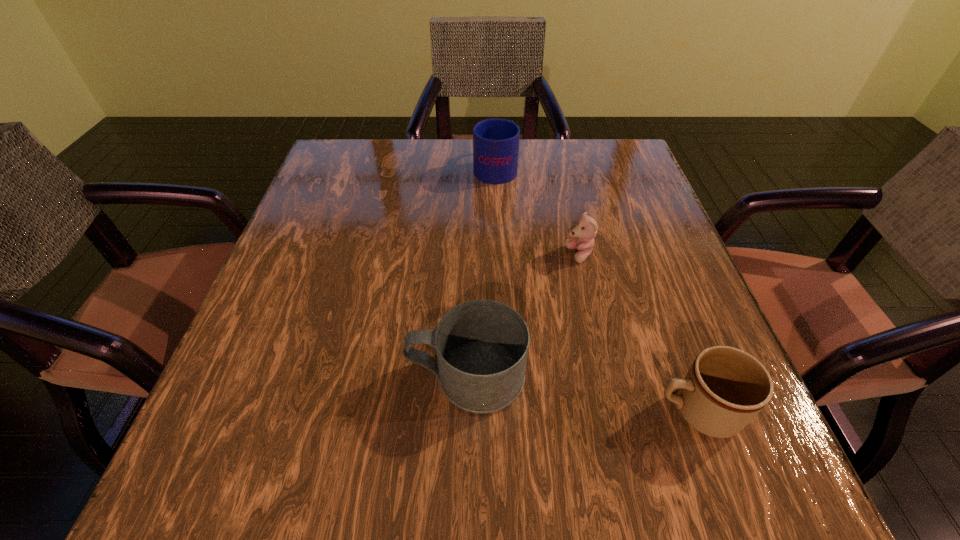
In the image, there is a desktop. Identify the location of free space at the far right corner. (625, 151).

This screenshot has width=960, height=540. In order to click on vacant space that is in between the farthest mug and the second object from right to left in this screenshot , I will do (x=538, y=211).

Locate an element on the screen. vacant area that lies between the farthest object and the teddy bear is located at coordinates (538, 211).

You are a GUI agent. You are given a task and a screenshot of the screen. Output one action in this format:
    pyautogui.click(x=<x>, y=<y>)
    Task: Click on the vacant area between the third nearest object and the farthest mug
    Image resolution: width=960 pixels, height=540 pixels.
    Given the screenshot: What is the action you would take?
    pyautogui.click(x=538, y=211)

The width and height of the screenshot is (960, 540). I want to click on free space between the second farthest object and the farthest object, so click(x=538, y=211).

Image resolution: width=960 pixels, height=540 pixels. In order to click on object that is the closest to the farthest object in this screenshot , I will do `click(586, 228)`.

In order to click on object that is the third closest to the third object from left to right in this screenshot , I will do `click(725, 388)`.

Identify which mug is the second nearest to the rightmost object. Please provide its 2D coordinates. Your answer should be formatted as a tuple, i.e. [(x, y)], where the tuple contains the x and y coordinates of a point satisfying the conditions above.

[(495, 141)]

Identify the location of mug object that ranks as the closest to the farthest mug. (482, 346).

Identify the location of free spot that satisfies the following two spatial constraints: 1. on the side of the rightmost object with the handle; 2. at the face of the second object from right to left. The height and width of the screenshot is (540, 960). (639, 255).